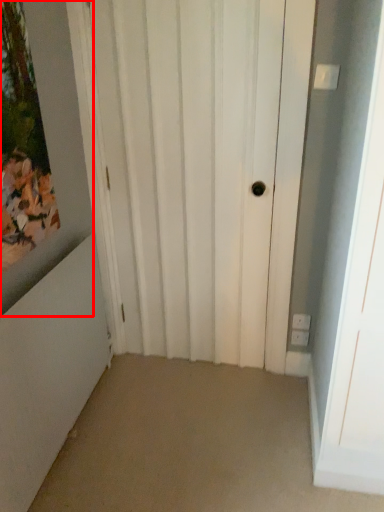
Question: In this image, where is picture frame (annotated by the red box) located relative to door?

Choices:
 (A) right
 (B) left

Answer: (B)